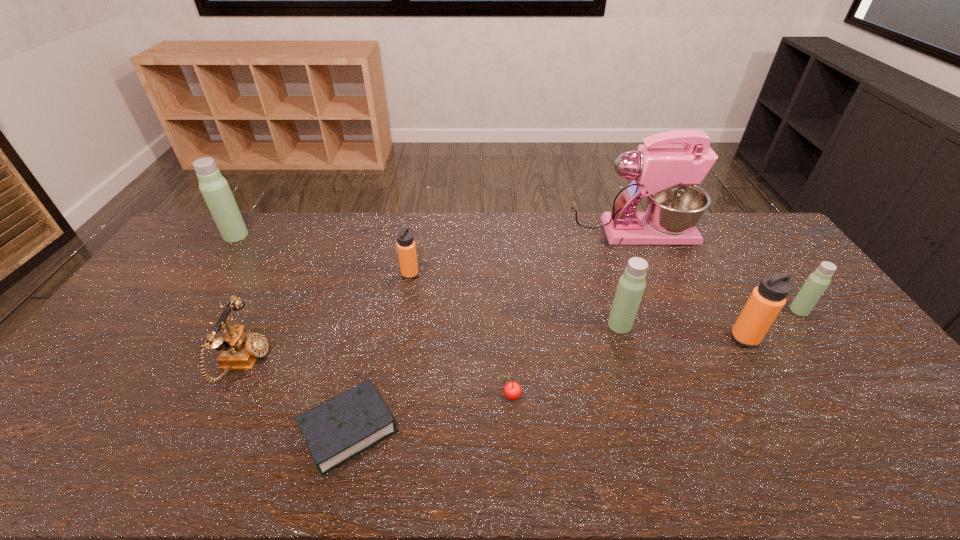
Locate an element on the screen. thermos bottle that stands as the third closest to the cherry is located at coordinates (766, 301).

Locate which light thermos bottle ranks second in proximity to the shortest object. Please provide its 2D coordinates. Your answer should be formatted as a tuple, i.e. [(x, y)], where the tuple contains the x and y coordinates of a point satisfying the conditions above.

[(214, 188)]

Select which light thermos bottle is the closest to the shortest object. Please provide its 2D coordinates. Your answer should be formatted as a tuple, i.e. [(x, y)], where the tuple contains the x and y coordinates of a point satisfying the conditions above.

[(631, 285)]

I want to click on vacant space that satisfies the following two spatial constraints: 1. on the front side of the smallest light thermos bottle; 2. on the dial number of the second object from left to right, so click(838, 362).

Where is `vacant area in the image that satisfies the following two spatial constraints: 1. on the dial number of the eighth object from right to left; 2. on the left side of the shortest object`? vacant area in the image that satisfies the following two spatial constraints: 1. on the dial number of the eighth object from right to left; 2. on the left side of the shortest object is located at coordinates (212, 429).

Find the location of a particular element. This screenshot has height=540, width=960. vacant space that satisfies the following two spatial constraints: 1. on the dial number of the second object from left to right; 2. on the left side of the Bible is located at coordinates (212, 429).

At what (x,y) coordinates should I click in order to perform the action: click on free region that satisfies the following two spatial constraints: 1. on the front side of the seventh nearest object; 2. on the dial number of the eighth object from right to left. Please return your answer as a coordinate pair (x, y). Image resolution: width=960 pixels, height=540 pixels. Looking at the image, I should click on (395, 362).